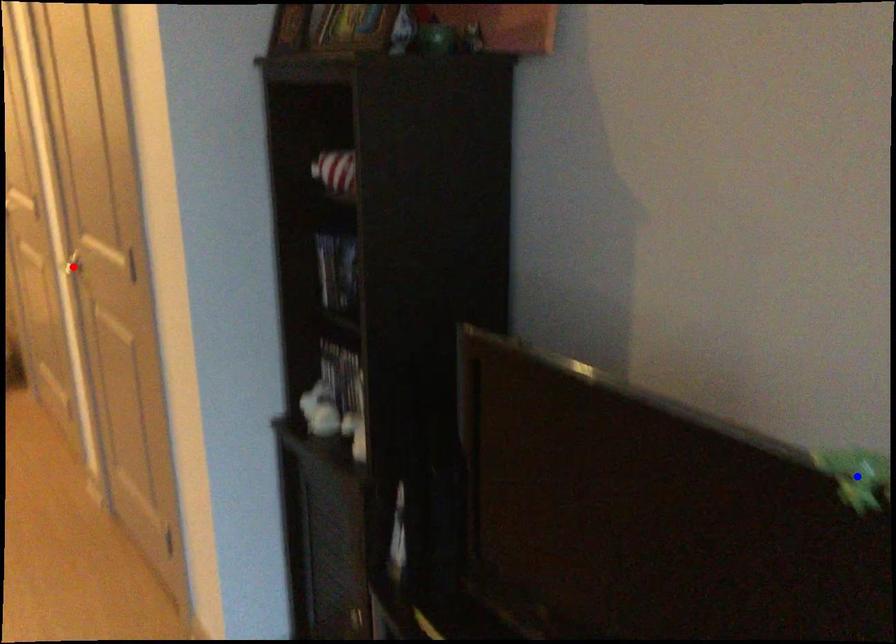
Question: Two points are marked on the image. Which point is closer to the camera?

Choices:
 (A) Blue point is closer.
 (B) Red point is closer.

Answer: (A)